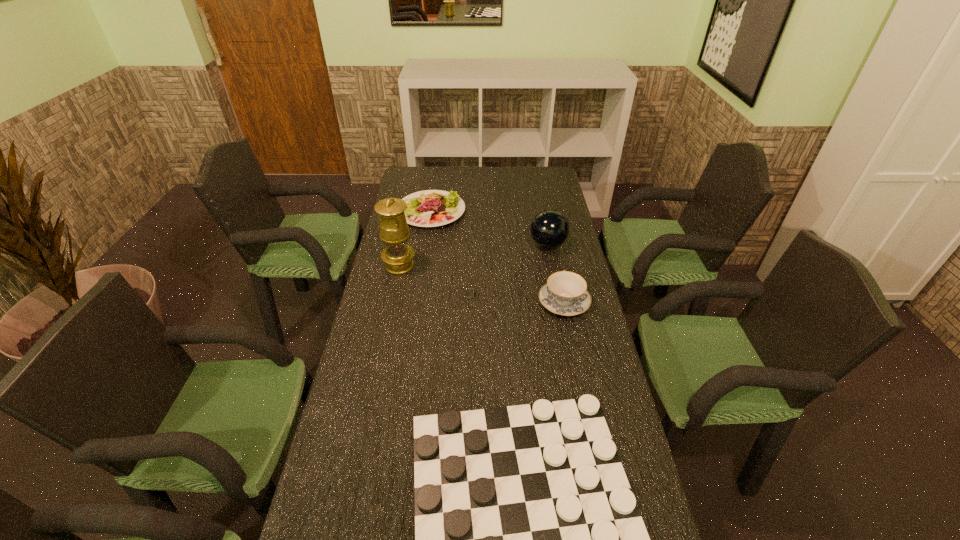
At what (x,y) coordinates should I click in order to perform the action: click on vacant space situated 0.160m with the handle on the side of the third tallest object. Please return your answer as a coordinate pair (x, y). This screenshot has height=540, width=960. Looking at the image, I should click on (555, 256).

You are a GUI agent. You are given a task and a screenshot of the screen. Output one action in this format:
    pyautogui.click(x=<x>, y=<y>)
    Task: Click on the vacant space located with the handle on the side of the third tallest object
    This screenshot has height=540, width=960.
    Given the screenshot: What is the action you would take?
    pyautogui.click(x=551, y=240)

Find the location of a particular element. free space located 0.270m with the handle on the side of the third tallest object is located at coordinates (551, 239).

Identify the location of blank area located on the right of the farthest object. The height and width of the screenshot is (540, 960). (553, 211).

In order to click on free point located on the face of the watch in this screenshot , I will do `click(503, 294)`.

Find the location of a particular element. oil lamp located at the left edge is located at coordinates (394, 232).

Identify the location of salad plate that is at the left edge. (429, 208).

Where is `bowling ball located at the right edge`? The width and height of the screenshot is (960, 540). bowling ball located at the right edge is located at coordinates (549, 229).

Find the location of a particular element. This screenshot has height=540, width=960. chinaware that is at the right edge is located at coordinates (565, 293).

The image size is (960, 540). I want to click on vacant space at the left edge, so click(328, 464).